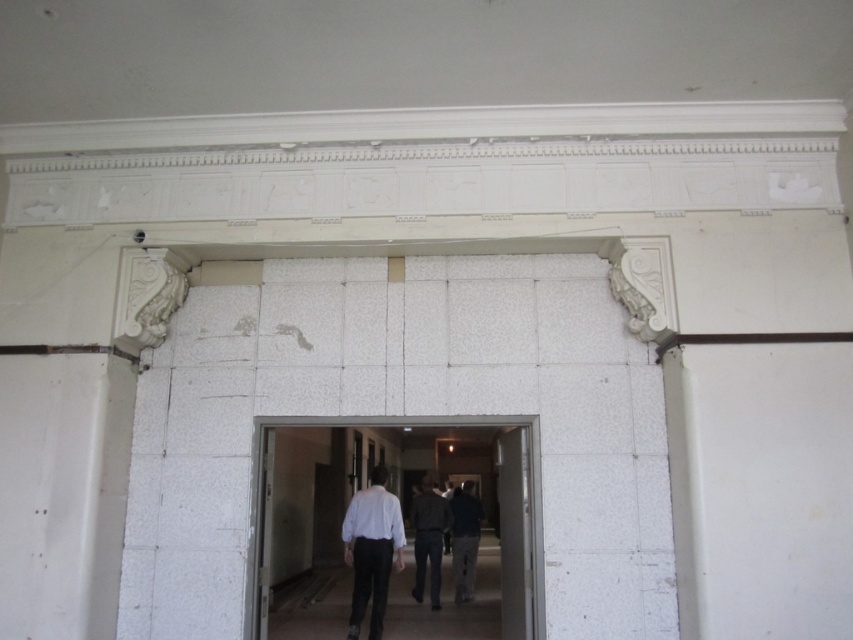
Question: Can you confirm if white textured door at center is wider than dark blue shirt at center?

Choices:
 (A) no
 (B) yes

Answer: (B)

Question: Estimate the real-world distances between objects in this image. Which object is farther from the dark blue shirt at center?

Choices:
 (A) white textured door at center
 (B) dark gray fabric jacket at center

Answer: (A)

Question: Which point is closer to the camera?

Choices:
 (A) dark gray fabric jacket at center
 (B) white textured door at center
 (C) white matte shirt at center

Answer: (B)

Question: Which point is closer to the camera?

Choices:
 (A) (469, 600)
 (B) (247, 586)

Answer: (B)

Question: Can you confirm if white textured door at center is wider than dark blue shirt at center?

Choices:
 (A) no
 (B) yes

Answer: (B)

Question: Does white matte shirt at center have a smaller size compared to dark gray fabric jacket at center?

Choices:
 (A) yes
 (B) no

Answer: (A)